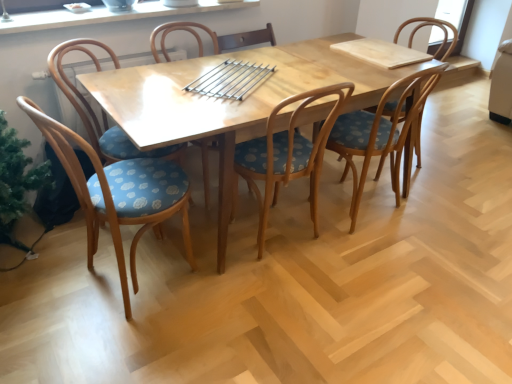
Where is `free space in front of blue polka dot fabric chair at center, which appears as the 6th chair when viewed from the left`? free space in front of blue polka dot fabric chair at center, which appears as the 6th chair when viewed from the left is located at coordinates (433, 195).